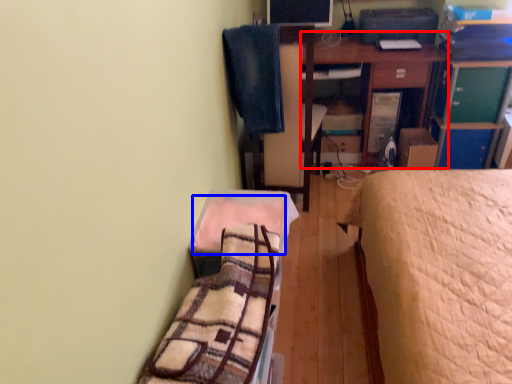
Question: Which object appears farthest to the camera in this image, table (highlighted by a red box) or blanket (highlighted by a blue box)?

Choices:
 (A) table
 (B) blanket

Answer: (A)